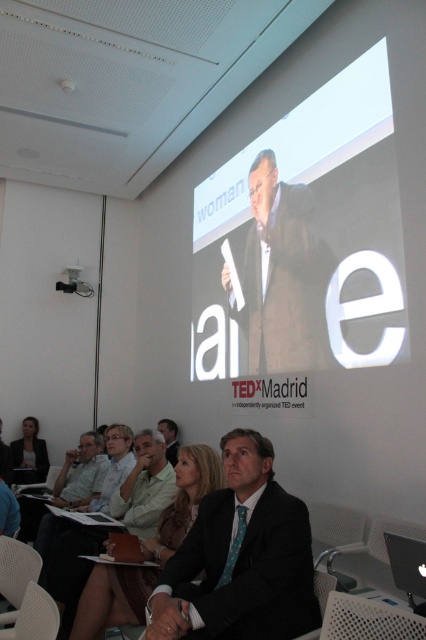
Question: Estimate the real-world distances between objects in this image. Which object is closer to the dark gray suit at center?

Choices:
 (A) dark brown leather jacket at center
 (B) dark gray suit at lower left
 (C) white plastic chair at lower left

Answer: (A)

Question: Among these points, which one is nearest to the camera?

Choices:
 (A) (29, 435)
 (B) (273, 180)
 (C) (16, 598)
 (D) (166, 458)

Answer: (C)

Question: Among these objects, which one is nearest to the camera?

Choices:
 (A) white matte projection screen at upper center
 (B) white mesh chair at lower center

Answer: (B)

Question: Is metallic silver chair at lower right to the right of dark brown suit at center from the viewer's perspective?

Choices:
 (A) no
 (B) yes

Answer: (B)

Question: Does metallic silver chair at lower right appear on the left side of white fabric chair at lower left?

Choices:
 (A) yes
 (B) no

Answer: (B)

Question: Is white matte projection screen at upper center to the left of brown textured suit at center from the viewer's perspective?

Choices:
 (A) no
 (B) yes

Answer: (A)